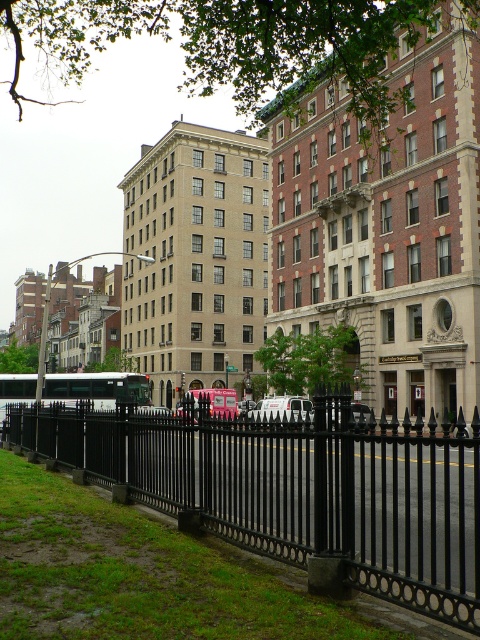
Does black wrought iron fence at lower left have a smaller size compared to metallic silver bus at center?

No, black wrought iron fence at lower left is not smaller than metallic silver bus at center.

Between black wrought iron fence at lower left and metallic silver bus at center, which one appears on the left side from the viewer's perspective?

From the viewer's perspective, metallic silver bus at center appears more on the left side.

At what (x,y) coordinates should I click in order to perform the action: click on black wrought iron fence at lower left. Please return your answer as a coordinate pair (x, y). The image size is (480, 640). Looking at the image, I should click on (299, 488).

Does point (70, 387) come in front of point (205, 392)?

Yes, point (70, 387) is in front of point (205, 392).

Is white matte bus at center bigger than metallic silver bus at center?

Incorrect, white matte bus at center is not larger than metallic silver bus at center.

Who is more distant from viewer, (98, 372) or (196, 394)?

Point (196, 394)

The image size is (480, 640). Identify the location of white matte bus at center. (96, 388).

Describe the element at coordinates (282, 410) in the screenshot. I see `white matte van at center` at that location.

Is point (299, 410) farther from viewer compared to point (197, 403)?

Yes, point (299, 410) is behind point (197, 403).

The image size is (480, 640). I want to click on white matte van at center, so click(282, 410).